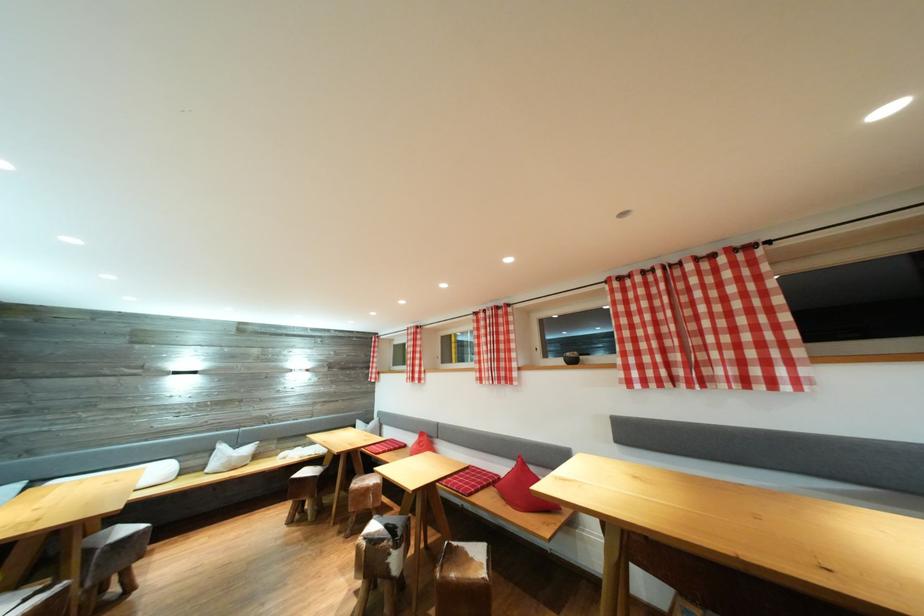
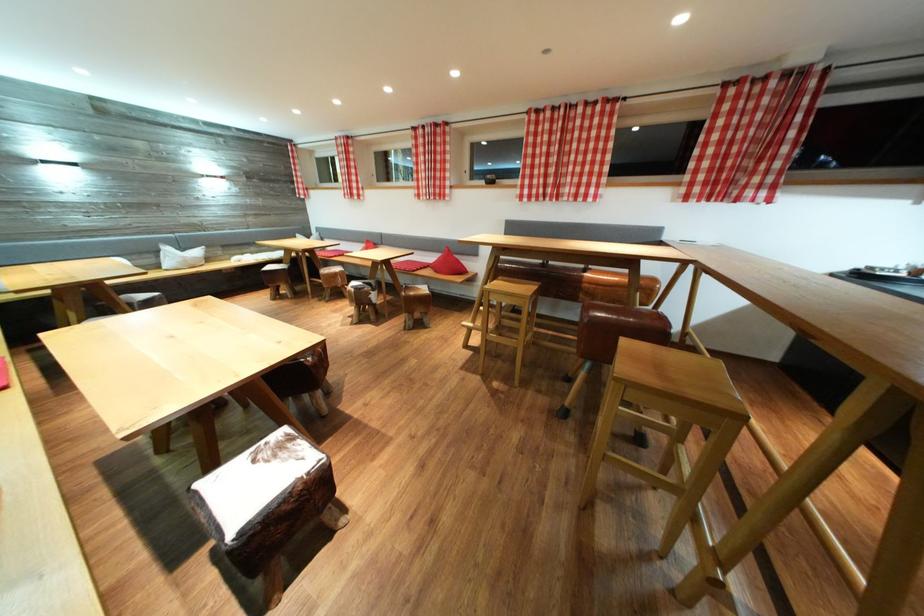
Find the pixel in the second image that matches the point at 377,546 in the first image.

(362, 294)